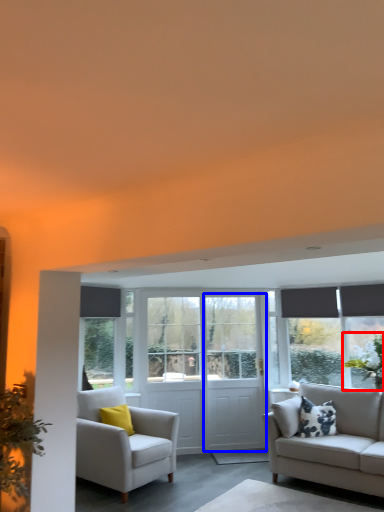
Question: Which point is closer to the camera, plant (highlighted by a red box) or screen door (highlighted by a blue box)?

Choices:
 (A) plant
 (B) screen door

Answer: (A)